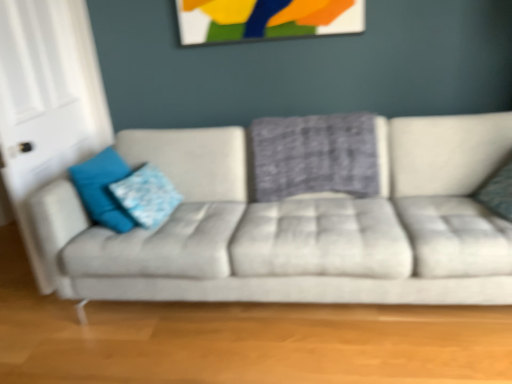
Question: Would you say blue fabric pillow at left, acting as the 2th pillow starting from the left, is outside teal fabric pillow at right, which is the 4th pillow in left-to-right order?

Choices:
 (A) no
 (B) yes

Answer: (B)

Question: From a real-world perspective, is blue fabric pillow at left, acting as the 2th pillow starting from the left, physically below teal fabric pillow at right, which is the 4th pillow in left-to-right order?

Choices:
 (A) no
 (B) yes

Answer: (B)

Question: Considering the relative sizes of blue fabric pillow at left, which ranks as the third pillow in right-to-left order, and teal fabric pillow at right, marked as the 1th pillow in a right-to-left arrangement, in the image provided, is blue fabric pillow at left, which ranks as the third pillow in right-to-left order, bigger than teal fabric pillow at right, marked as the 1th pillow in a right-to-left arrangement,?

Choices:
 (A) no
 (B) yes

Answer: (B)

Question: From the image's perspective, would you say blue fabric pillow at left, acting as the 2th pillow starting from the left, is shown under teal fabric pillow at right, marked as the 1th pillow in a right-to-left arrangement?

Choices:
 (A) no
 (B) yes

Answer: (B)

Question: Considering the relative positions of blue fabric pillow at left, which ranks as the third pillow in right-to-left order, and teal fabric pillow at right, which is the 4th pillow in left-to-right order, in the image provided, is blue fabric pillow at left, which ranks as the third pillow in right-to-left order, to the right of teal fabric pillow at right, which is the 4th pillow in left-to-right order, from the viewer's perspective?

Choices:
 (A) yes
 (B) no

Answer: (B)

Question: Does blue fabric pillow at left, acting as the 2th pillow starting from the left, appear on the left side of teal fabric pillow at right, which is the 4th pillow in left-to-right order?

Choices:
 (A) yes
 (B) no

Answer: (A)

Question: Can you confirm if plaid fabric pillow at center, which is the third pillow in left-to-right order, is thinner than painted wood picture frame at upper center?

Choices:
 (A) yes
 (B) no

Answer: (B)

Question: Is plaid fabric pillow at center, which is the third pillow in left-to-right order, directly adjacent to painted wood picture frame at upper center?

Choices:
 (A) no
 (B) yes

Answer: (A)

Question: Is plaid fabric pillow at center, which is the third pillow in left-to-right order, behind painted wood picture frame at upper center?

Choices:
 (A) no
 (B) yes

Answer: (A)

Question: Is plaid fabric pillow at center, which is the third pillow in left-to-right order, at the right side of painted wood picture frame at upper center?

Choices:
 (A) no
 (B) yes

Answer: (B)

Question: Is plaid fabric pillow at center, marked as the second pillow in a right-to-left arrangement, not inside painted wood picture frame at upper center?

Choices:
 (A) no
 (B) yes

Answer: (B)

Question: Is painted wood picture frame at upper center completely or partially inside plaid fabric pillow at center, marked as the second pillow in a right-to-left arrangement?

Choices:
 (A) yes
 (B) no

Answer: (B)

Question: Does blue fabric pillow at left, the 1th pillow viewed from the left, lie behind teal fabric pillow at right, marked as the 1th pillow in a right-to-left arrangement?

Choices:
 (A) yes
 (B) no

Answer: (A)